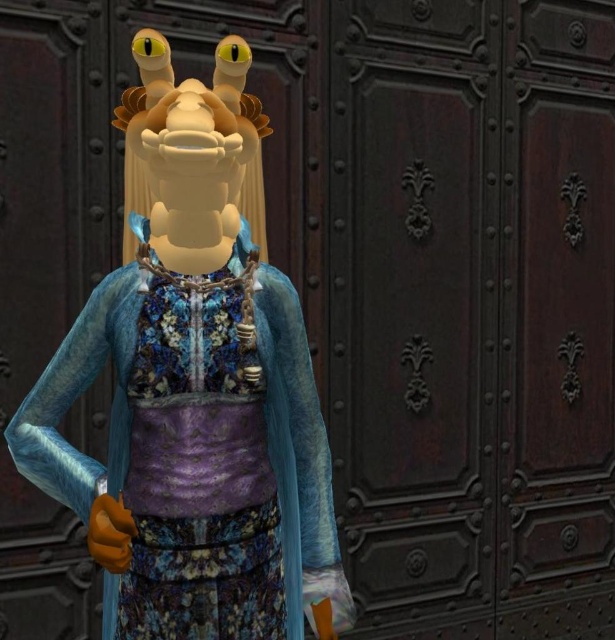
You are an interior designer arranging items on a shelf. You have a matte blue fabric doll at center and a velvet purple dress at center. According to the scene, which object is positioned to the left?

The matte blue fabric doll at center is to the left of the velvet purple dress at center.

You are an artist trying to draw the character in the image. You need to determine which of the two points, point [50,445] or point [180,317], is closer to the viewer. Which point should you emphasize more to create a sense of depth?

Point [50,445] is further to the viewer than point [180,317], so you should emphasize point [50,445] more to create a sense of depth.

Where is the matte blue fabric doll at center located in the image?

The matte blue fabric doll at center is located at point (196, 394).